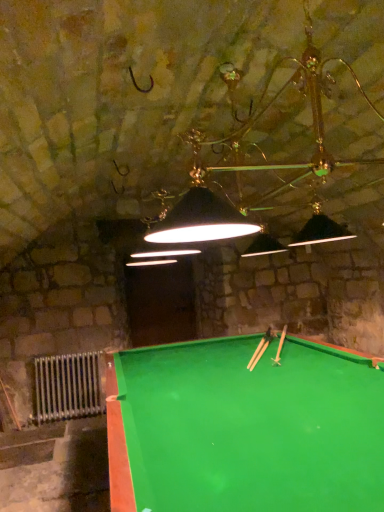
Question: In which direction should I rotate to look at wooden cue at center, the second cue positioned from the top?

Choices:
 (A) right
 (B) left

Answer: (A)

Question: Considering the relative positions of green plastic cue at center, which is counted as the 2th cue, starting from the bottom, and silver metallic radiator at lower left in the image provided, is green plastic cue at center, which is counted as the 2th cue, starting from the bottom, behind silver metallic radiator at lower left?

Choices:
 (A) no
 (B) yes

Answer: (A)

Question: Does green plastic cue at center, which ranks as the 1th cue in top-to-bottom order, contain silver metallic radiator at lower left?

Choices:
 (A) no
 (B) yes

Answer: (A)

Question: Is green plastic cue at center, which is counted as the 2th cue, starting from the bottom, next to silver metallic radiator at lower left?

Choices:
 (A) no
 (B) yes

Answer: (A)

Question: From a real-world perspective, is green plastic cue at center, which ranks as the 1th cue in top-to-bottom order, below silver metallic radiator at lower left?

Choices:
 (A) no
 (B) yes

Answer: (A)

Question: Is green plastic cue at center, which ranks as the 1th cue in top-to-bottom order, facing away from silver metallic radiator at lower left?

Choices:
 (A) no
 (B) yes

Answer: (A)

Question: Does green plastic cue at center, which ranks as the 1th cue in top-to-bottom order, have a greater width compared to silver metallic radiator at lower left?

Choices:
 (A) no
 (B) yes

Answer: (B)

Question: Does wooden cue at center, positioned as the first cue in bottom-to-top order, come in front of green felt billiard table at center?

Choices:
 (A) yes
 (B) no

Answer: (B)

Question: Is wooden cue at center, positioned as the first cue in bottom-to-top order, positioned beyond the bounds of green felt billiard table at center?

Choices:
 (A) yes
 (B) no

Answer: (B)

Question: Does wooden cue at center, the second cue positioned from the top, have a greater height compared to green felt billiard table at center?

Choices:
 (A) yes
 (B) no

Answer: (B)

Question: Considering the relative sizes of wooden cue at center, the second cue positioned from the top, and green felt billiard table at center in the image provided, is wooden cue at center, the second cue positioned from the top, shorter than green felt billiard table at center?

Choices:
 (A) yes
 (B) no

Answer: (A)

Question: Considering the relative sizes of wooden cue at center, the second cue positioned from the top, and green felt billiard table at center in the image provided, is wooden cue at center, the second cue positioned from the top, thinner than green felt billiard table at center?

Choices:
 (A) yes
 (B) no

Answer: (A)

Question: Can you confirm if wooden cue at center, the second cue positioned from the top, is wider than green felt billiard table at center?

Choices:
 (A) yes
 (B) no

Answer: (B)

Question: Is silver metallic radiator at lower left located outside green plastic cue at center, which is counted as the 2th cue, starting from the bottom?

Choices:
 (A) yes
 (B) no

Answer: (A)